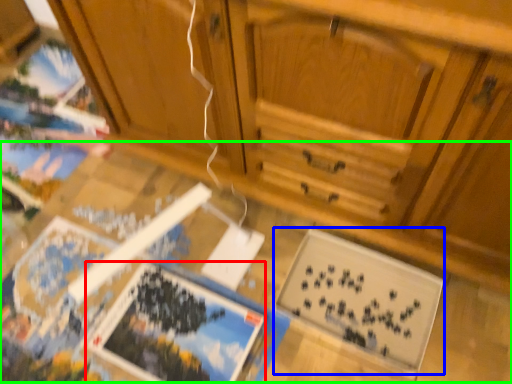
Question: Which is nearer to the magazine (highlighted by a red box)? magazine (highlighted by a blue box) or table (highlighted by a green box).

Choices:
 (A) magazine
 (B) table

Answer: (B)